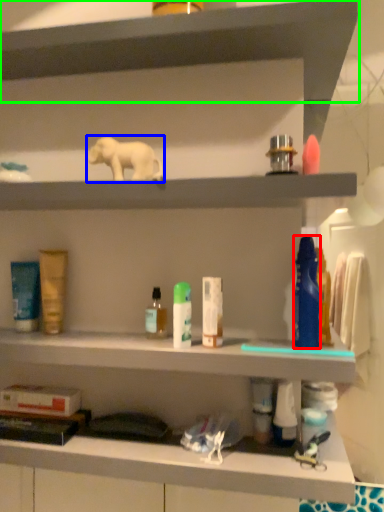
Question: Estimate the real-world distances between objects in this image. Which object is closer to mouthwash (highlighted by a red box), animal (highlighted by a blue box) or shelf (highlighted by a green box)?

Choices:
 (A) animal
 (B) shelf

Answer: (A)